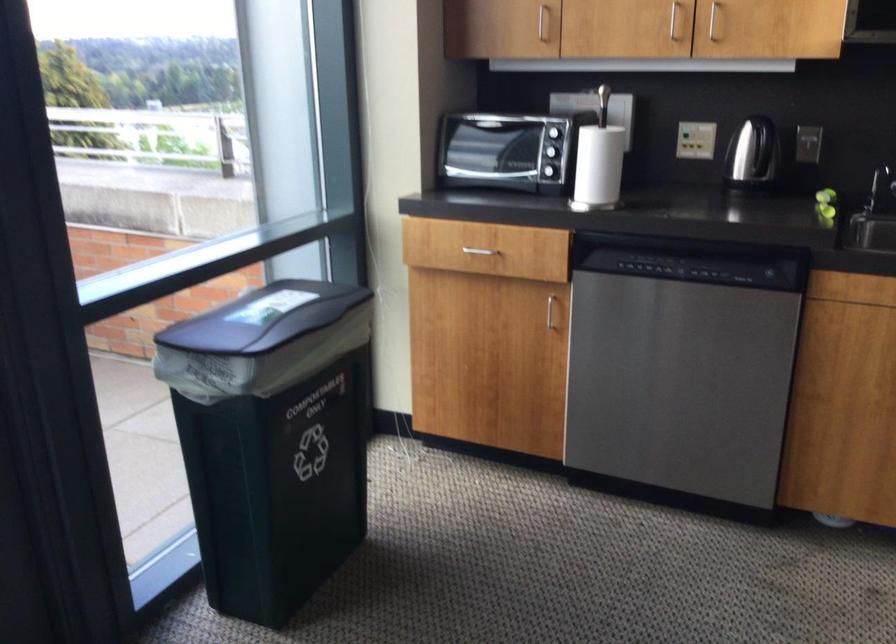
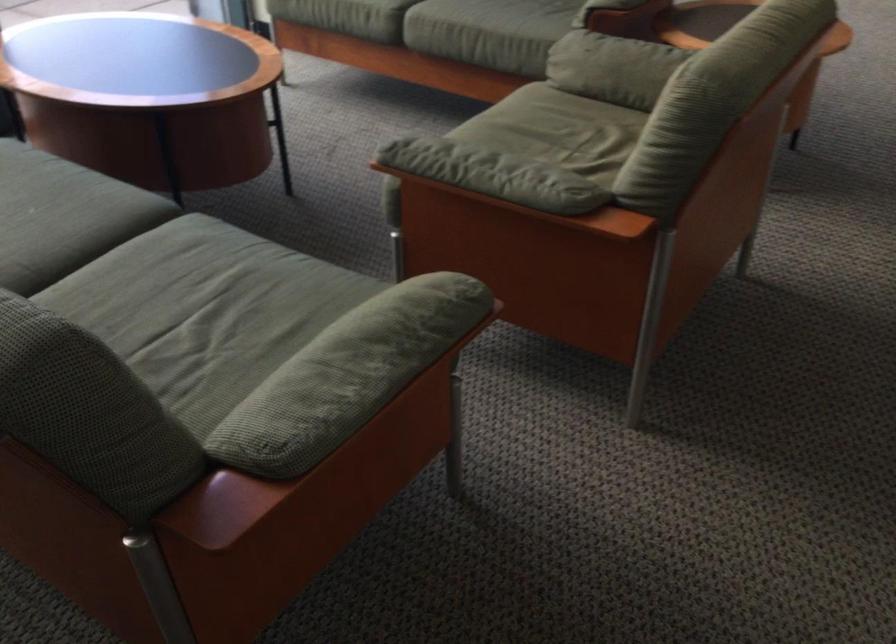
Question: The images are taken continuously from a first-person perspective. In which direction are you moving?

Choices:
 (A) Left
 (B) Right
 (C) Forward
 (D) Backward

Answer: (D)